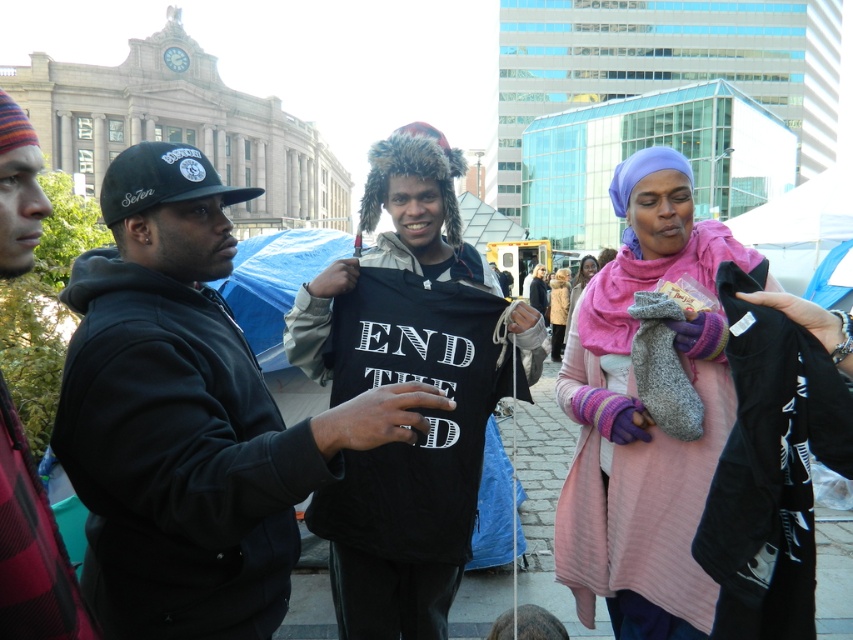
Question: Among these points, which one is nearest to the camera?

Choices:
 (A) (131, 236)
 (B) (579, 260)
 (C) (19, 522)
 (D) (558, 336)

Answer: (C)

Question: Based on their relative distances, which object is nearer to the plaid fabric shirt at left?

Choices:
 (A) black matte hoodie at center
 (B) pink woolen scarf at center
 (C) pink fleece scarf at center
 (D) black matte sweatshirt at center

Answer: (A)

Question: Which of the following is the closest to the observer?

Choices:
 (A) pyautogui.click(x=592, y=273)
 (B) pyautogui.click(x=556, y=392)
 (C) pyautogui.click(x=393, y=497)
 (D) pyautogui.click(x=15, y=273)

Answer: (D)

Question: Is pink woolen scarf at center to the left of plaid fabric shirt at left from the viewer's perspective?

Choices:
 (A) no
 (B) yes

Answer: (A)

Question: Can you confirm if black matte hoodie at center is bigger than pink woolen scarf at center?

Choices:
 (A) yes
 (B) no

Answer: (A)

Question: Considering the relative positions of plaid fabric shirt at left and pink fleece jacket at center in the image provided, where is plaid fabric shirt at left located with respect to pink fleece jacket at center?

Choices:
 (A) above
 (B) below

Answer: (B)